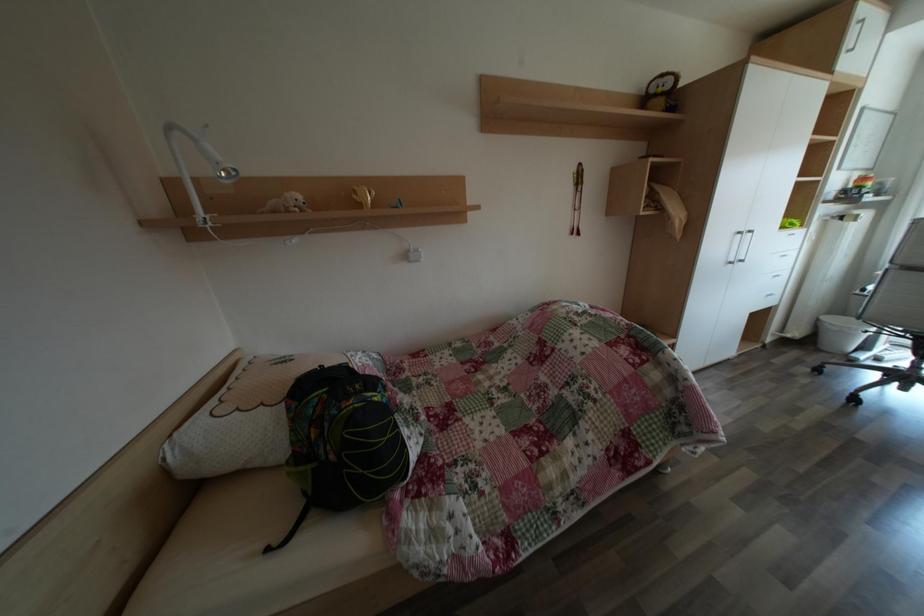
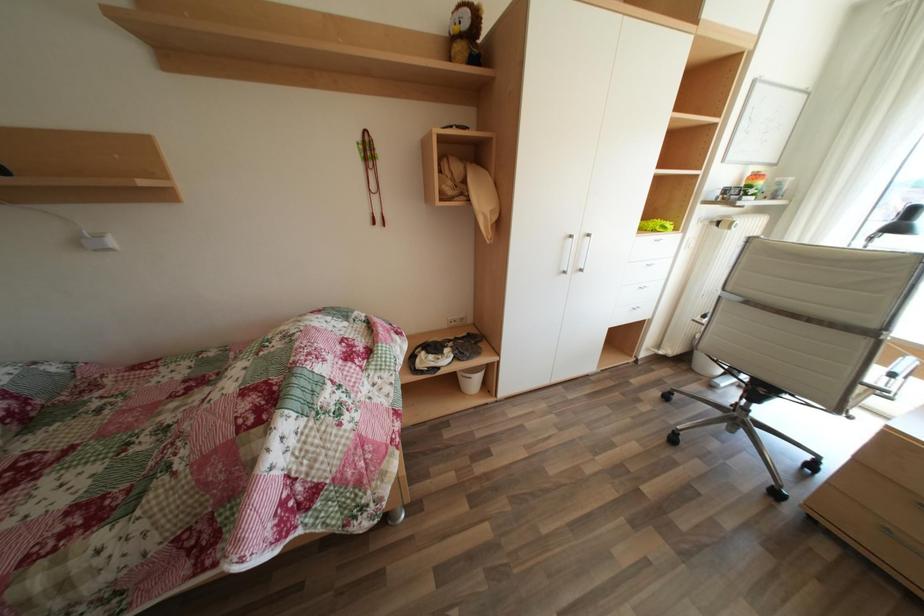
Question: The images are taken continuously from a first-person perspective. In which direction are you moving?

Choices:
 (A) Left
 (B) Right
 (C) Forward
 (D) Backward

Answer: (B)